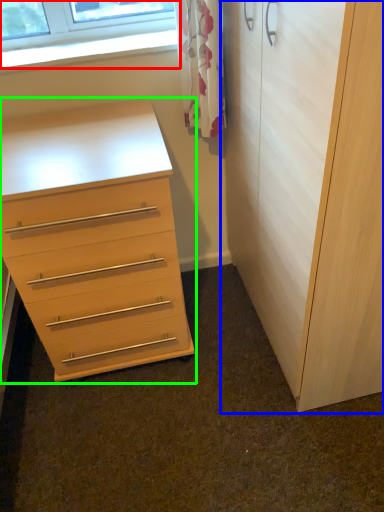
Question: Considering the real-world distances, which object is closest to window (highlighted by a red box)? cupboard (highlighted by a blue box) or chest of drawers (highlighted by a green box).

Choices:
 (A) cupboard
 (B) chest of drawers

Answer: (B)